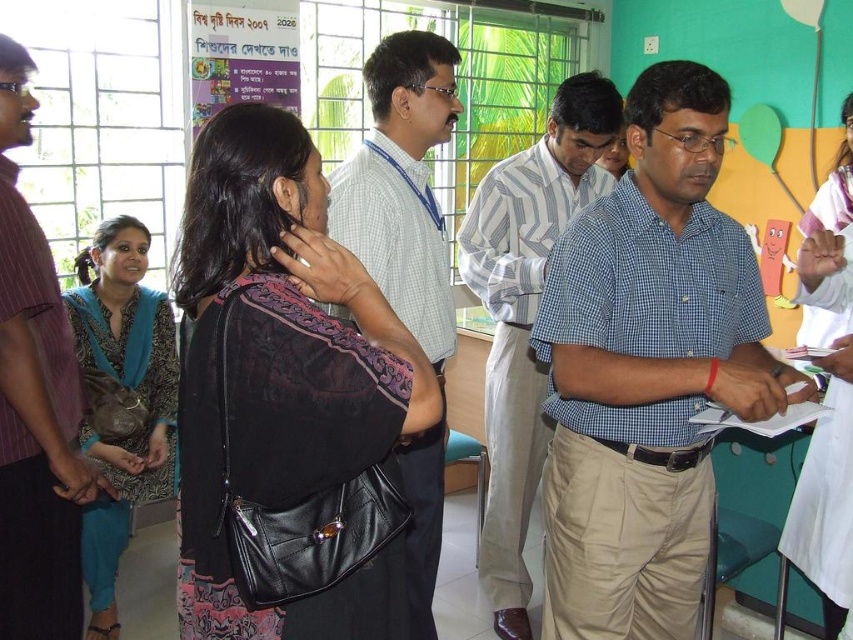
You are standing in the room and want to reach a point that is 5.59 feet away from you. Is the point at coordinates point (566, 572) within reach if you can extend your arm 5 feet?

The point (566, 572) is 5.59 feet away from the viewer. Since your arm can only extend 5 feet, you cannot reach it.

You are organizing a charity event and need to arrange shirts of different widths for a display. You have a blue checkered shirt at center and a striped cotton shirt at left. Which shirt should you choose if you want the wider one for the center of the display?

The blue checkered shirt at center is wider than the striped cotton shirt at left, so you should choose the blue checkered shirt at center for the center of the display.